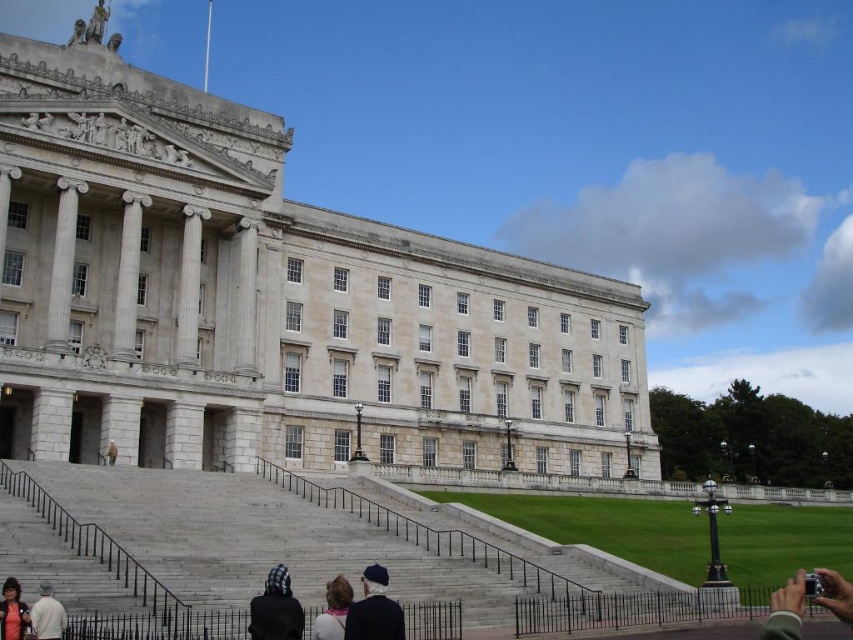
You are a photographer planning to take a picture of the white stone building at center and the dark brown hair at lower left. Which object should you focus on first if you want to capture both in a single frame without moving the camera?

You should focus on the white stone building at center first because it is larger in size than the dark brown hair at lower left, making it the primary subject for the frame.

You are standing at the base of the grand staircase of the neoclassical building and see a black knit cap at lower center and a white cotton shirt at lower left. Which object is taller?

The black knit cap at lower center is much taller than the white cotton shirt at lower left.

You are standing at the base of the grand staircase of the neoclassical building. You want to reach the entrance at the top of the staircase. If you walk straight towards the entrance, will you pass through the point labeled as point (331, 291)?

Yes, because the point (331, 291) is located along the path towards the entrance, so walking straight will pass through it.